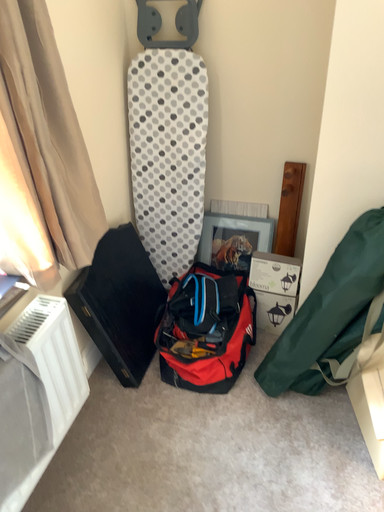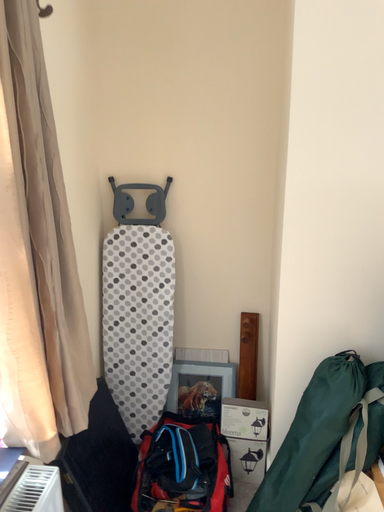
Question: How did the camera likely rotate when shooting the video?

Choices:
 (A) rotated left
 (B) rotated right

Answer: (B)